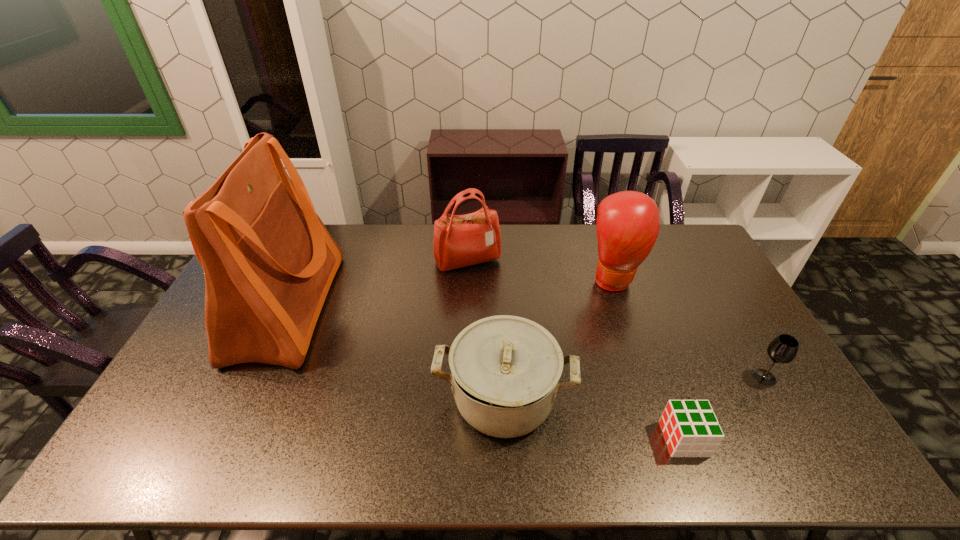
You are a GUI agent. You are given a task and a screenshot of the screen. Output one action in this format:
    pyautogui.click(x=<x>, y=<y>)
    Task: Click on the leftmost object
    The image size is (960, 540).
    Given the screenshot: What is the action you would take?
    pyautogui.click(x=268, y=260)

Locate an element on the screen. Image resolution: width=960 pixels, height=540 pixels. shopping bag is located at coordinates (268, 260).

Identify the location of boxing glove. (628, 222).

The width and height of the screenshot is (960, 540). I want to click on handbag, so click(459, 240).

Locate an element on the screen. The height and width of the screenshot is (540, 960). saucepan is located at coordinates (506, 369).

Locate an element on the screen. The width and height of the screenshot is (960, 540). the second shortest object is located at coordinates (783, 349).

Locate an element on the screen. wineglass is located at coordinates point(783,349).

Where is `the shortest object`? The width and height of the screenshot is (960, 540). the shortest object is located at coordinates 690,428.

Locate an element on the screen. The height and width of the screenshot is (540, 960). free space located on the front pocket of the tallest object is located at coordinates (419, 307).

Locate an element on the screen. The height and width of the screenshot is (540, 960). free space located on the striking surface of the boxing glove is located at coordinates (636, 346).